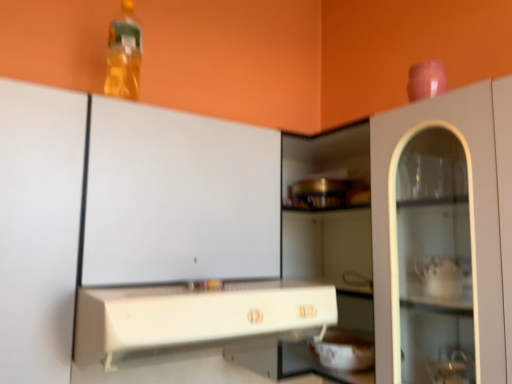
I want to click on free space in front of translucent plastic bottle at upper left, so click(x=94, y=101).